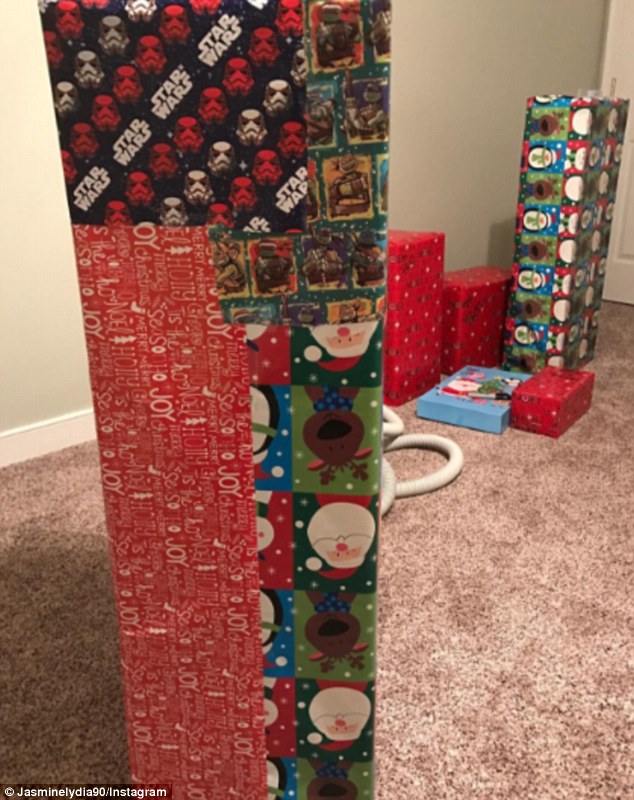
I want to click on baseboard, so click(49, 430).